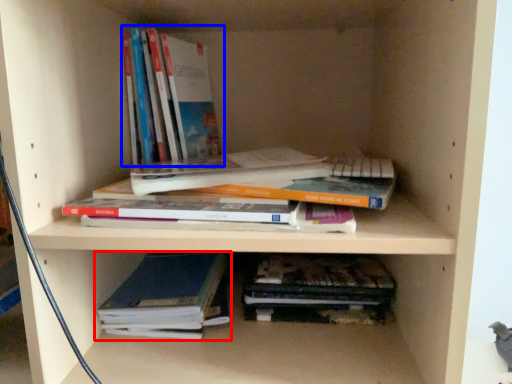
Question: Which of the following is the farthest to the observer, book (highlighted by a red box) or book (highlighted by a blue box)?

Choices:
 (A) book
 (B) book

Answer: (B)